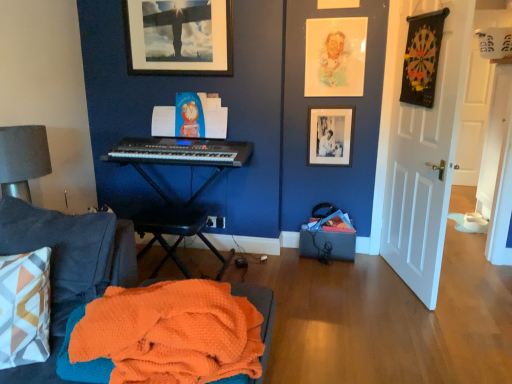
At what (x,y) coordinates should I click in order to perform the action: click on free space that is in between white matte door at right and black plastic keyboard at center. Please return your answer as a coordinate pair (x, y). Looking at the image, I should click on (324, 280).